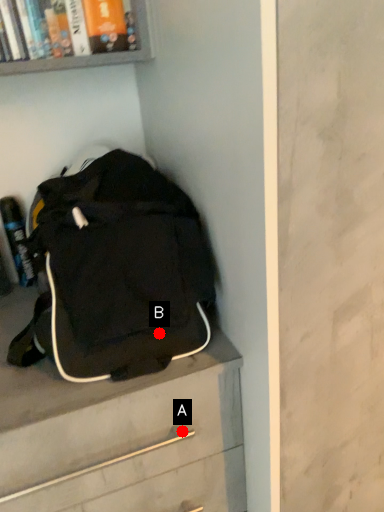
Question: Two points are circled on the image, labeled by A and B beside each circle. Which of the following is the farthest from the observer?

Choices:
 (A) A is further
 (B) B is further

Answer: (A)